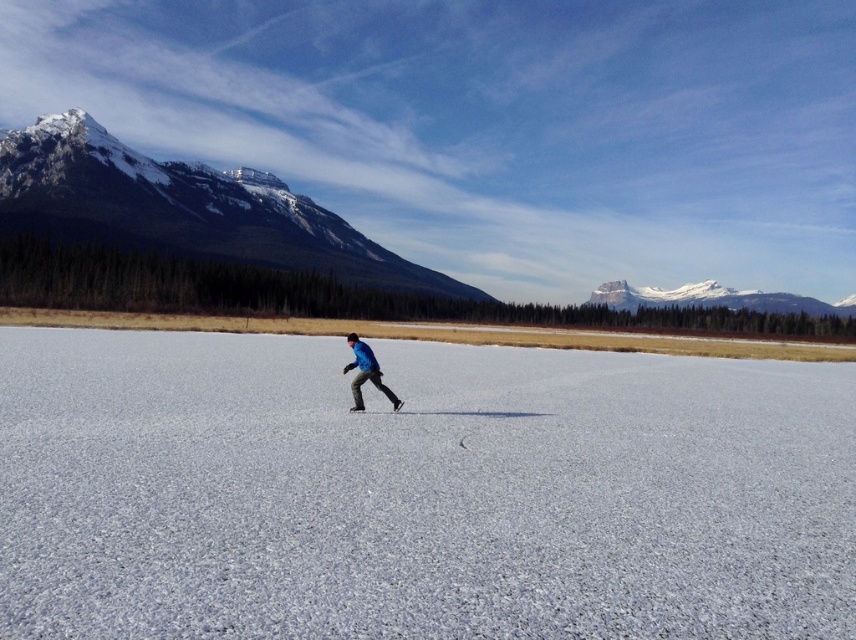
You are planning to build a small ice rink for a winter festival. You have a space that can accommodate an area as wide as the snowy granite mountain at upper left. Will the white ice at center fit into this space?

The white ice at center has a lesser width compared to the snowy granite mountain at upper left, so yes, the white ice at center will fit into the space since it is narrower than the mountain.

You are standing at the point labeled point (40, 157) and want to walk to the point labeled point (393, 410). Given the scene description, which direction should you move to reach your destination?

Since point (40, 157) is behind point (393, 410), you should move forward to reach point (393, 410) from your current position at point (40, 157).

You are planning to place a 200 meter long banner between the snowy granite mountain at upper left and the black matte ski at center. Will the banner be long enough to stretch between them?

The distance between the snowy granite mountain at upper left and the black matte ski at center is 223.91 meters. Since the banner is only 200 meters long, it will not be long enough to stretch between them.